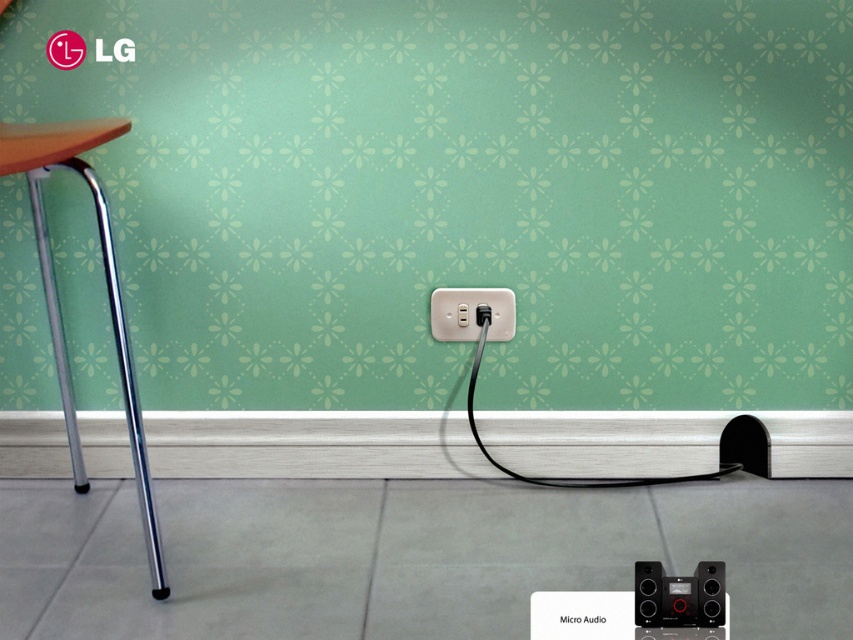
Is black matte speaker at lower right positioned behind black plastic speaker at lower right?

That is True.

In order to click on black matte speaker at lower right in this screenshot , I will do `click(647, 593)`.

Does black cable at lower center have a smaller size compared to black plastic speaker at lower right?

No.

Which is in front, point (467, 397) or point (683, 580)?

Point (683, 580) is more forward.

Locate an element on the screen. black cable at lower center is located at coordinates (567, 477).

Does silver/chrome chair leg at left have a greater height compared to beige plastic electrical outlet at center?

Yes, silver/chrome chair leg at left is taller than beige plastic electrical outlet at center.

Is silver/chrome chair leg at left to the left of beige plastic electrical outlet at center from the viewer's perspective?

Indeed, silver/chrome chair leg at left is positioned on the left side of beige plastic electrical outlet at center.

Who is more forward, (78, 124) or (514, 317)?

Positioned in front is point (78, 124).

This screenshot has height=640, width=853. What are the coordinates of `silver/chrome chair leg at left` in the screenshot? It's located at (106, 284).